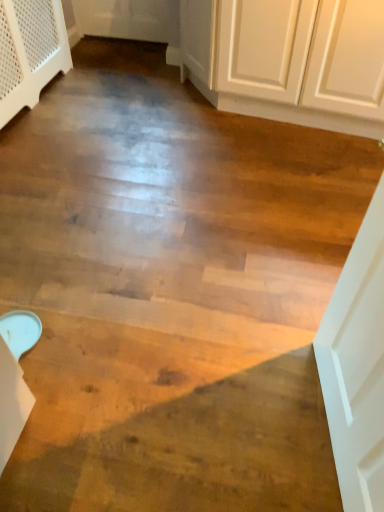
Find the location of a particular element. This screenshot has height=512, width=384. free space in front of white textured dresser at upper left is located at coordinates (58, 150).